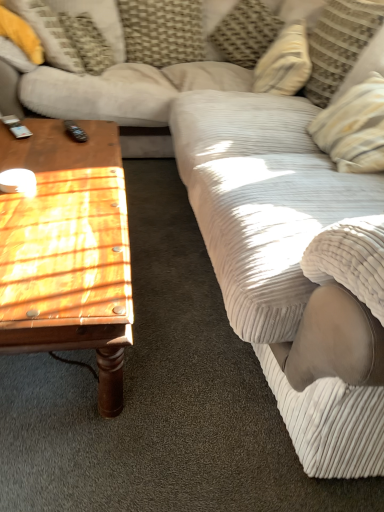
Question: Can you confirm if yellow fabric pillow at upper left, which is counted as the fourth pillow, starting from the right, is wider than wooden polished coffee table at left?

Choices:
 (A) no
 (B) yes

Answer: (B)

Question: Is yellow fabric pillow at upper left, the first pillow when ordered from left to right, thinner than wooden polished coffee table at left?

Choices:
 (A) no
 (B) yes

Answer: (A)

Question: Is wooden polished coffee table at left completely or partially inside yellow fabric pillow at upper left, which is counted as the fourth pillow, starting from the right?

Choices:
 (A) no
 (B) yes

Answer: (A)

Question: From the image's perspective, is yellow fabric pillow at upper left, the first pillow when ordered from left to right, on wooden polished coffee table at left?

Choices:
 (A) yes
 (B) no

Answer: (A)

Question: Is yellow fabric pillow at upper left, the first pillow when ordered from left to right, next to wooden polished coffee table at left?

Choices:
 (A) no
 (B) yes

Answer: (A)

Question: Does yellow fabric pillow at upper left, the first pillow when ordered from left to right, appear on the left side of wooden polished coffee table at left?

Choices:
 (A) yes
 (B) no

Answer: (A)

Question: From the image's perspective, is yellow fabric pillow at upper left, the first pillow when ordered from left to right, over black plastic remote at left?

Choices:
 (A) yes
 (B) no

Answer: (A)

Question: Are yellow fabric pillow at upper left, which is counted as the fourth pillow, starting from the right, and black plastic remote at left making contact?

Choices:
 (A) yes
 (B) no

Answer: (B)

Question: Considering the relative sizes of yellow fabric pillow at upper left, the first pillow when ordered from left to right, and black plastic remote at left in the image provided, is yellow fabric pillow at upper left, the first pillow when ordered from left to right, shorter than black plastic remote at left?

Choices:
 (A) yes
 (B) no

Answer: (B)

Question: Is yellow fabric pillow at upper left, which is counted as the fourth pillow, starting from the right, aimed at black plastic remote at left?

Choices:
 (A) no
 (B) yes

Answer: (B)

Question: Is yellow fabric pillow at upper left, the first pillow when ordered from left to right, positioned before black plastic remote at left?

Choices:
 (A) no
 (B) yes

Answer: (A)

Question: From the image's perspective, would you say yellow fabric pillow at upper left, which is counted as the fourth pillow, starting from the right, is shown under black plastic remote at left?

Choices:
 (A) yes
 (B) no

Answer: (B)

Question: Is striped fabric pillow at upper right, the fourth pillow from the left, at the back of wooden polished coffee table at left?

Choices:
 (A) yes
 (B) no

Answer: (B)